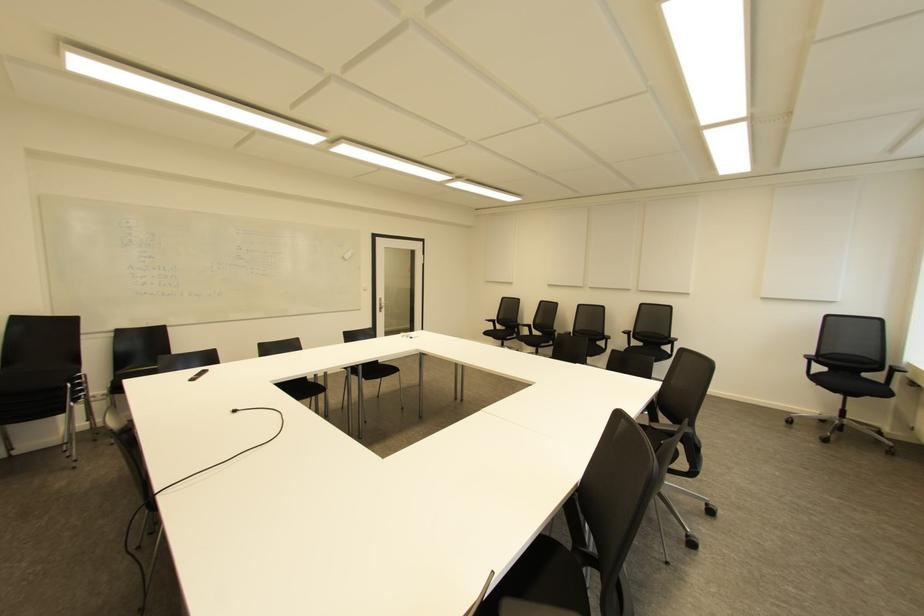
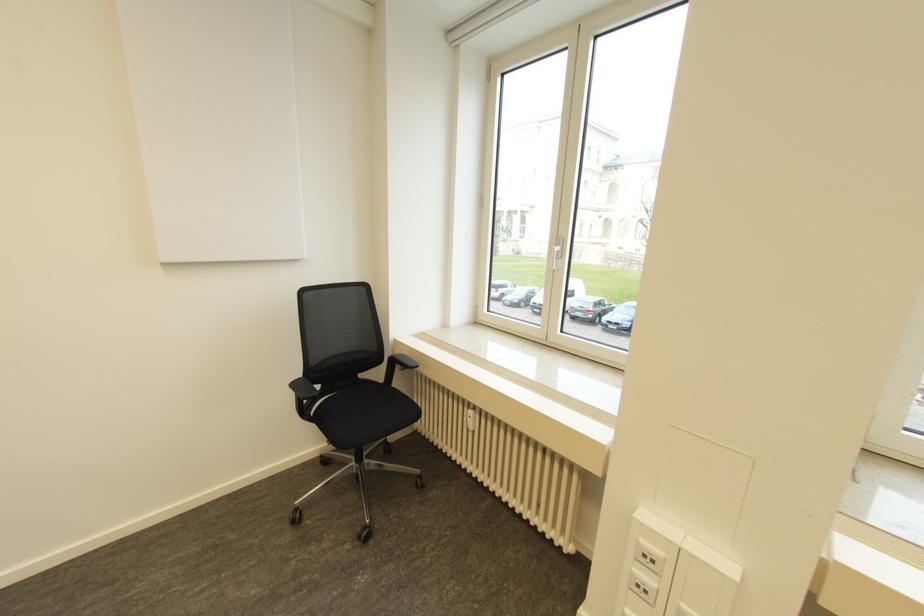
Find the pixel in the second image that matches [893,370] in the first image.

(394, 360)